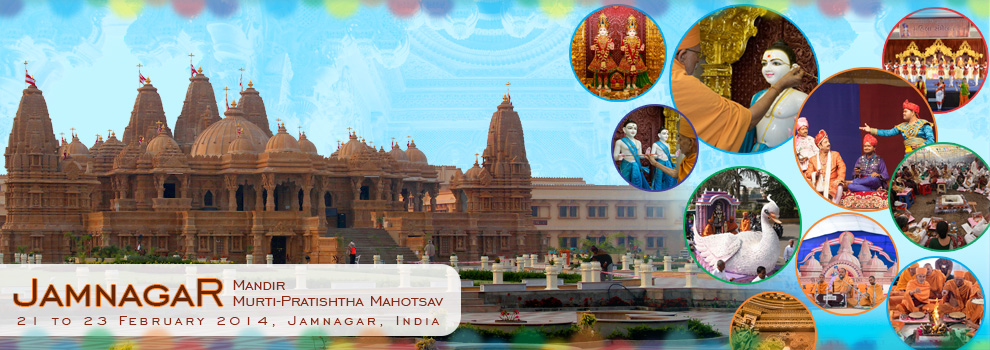
You are a GUI agent. You are given a task and a screenshot of the screen. Output one action in this format:
    pyautogui.click(x=<x>, y=<y>)
    Task: Click on the 3 stairs
    
    Given the screenshot: What is the action you would take?
    pyautogui.click(x=600, y=253), pyautogui.click(x=351, y=248), pyautogui.click(x=428, y=248)